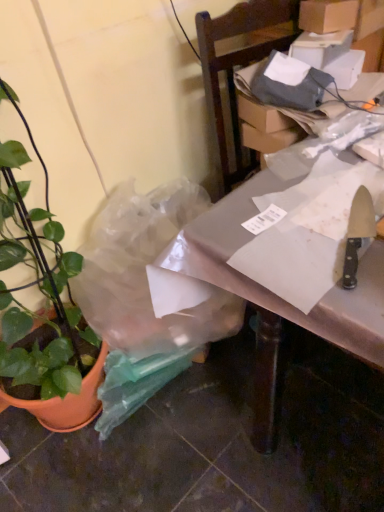
Question: Is white paper at right inside cardboard box at upper right?

Choices:
 (A) yes
 (B) no

Answer: (B)

Question: Is cardboard box at upper right turned away from white paper at right?

Choices:
 (A) no
 (B) yes

Answer: (A)

Question: Does cardboard box at upper right come in front of white paper at right?

Choices:
 (A) no
 (B) yes

Answer: (A)

Question: Is cardboard box at upper right not near white paper at right?

Choices:
 (A) no
 (B) yes

Answer: (A)

Question: From a real-world perspective, is cardboard box at upper right physically below white paper at right?

Choices:
 (A) yes
 (B) no

Answer: (B)

Question: Can you confirm if cardboard box at upper right is positioned to the left of white paper at right?

Choices:
 (A) no
 (B) yes

Answer: (A)

Question: From a real-world perspective, does green matte plant pot at left stand above cardboard box at upper right?

Choices:
 (A) yes
 (B) no

Answer: (B)

Question: Is the depth of green matte plant pot at left greater than that of cardboard box at upper right?

Choices:
 (A) yes
 (B) no

Answer: (B)

Question: Does green matte plant pot at left turn towards cardboard box at upper right?

Choices:
 (A) no
 (B) yes

Answer: (A)

Question: Does green matte plant pot at left have a lesser height compared to cardboard box at upper right?

Choices:
 (A) no
 (B) yes

Answer: (A)

Question: From the image's perspective, would you say green matte plant pot at left is shown under cardboard box at upper right?

Choices:
 (A) yes
 (B) no

Answer: (A)

Question: Is green matte plant pot at left to the left of cardboard box at upper right from the viewer's perspective?

Choices:
 (A) yes
 (B) no

Answer: (A)

Question: Does cardboard box at upper right have a greater width compared to green matte plant pot at left?

Choices:
 (A) no
 (B) yes

Answer: (A)